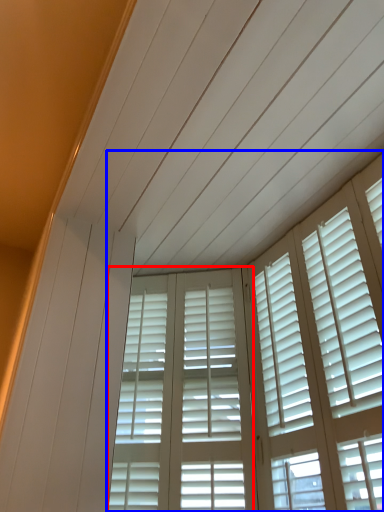
Question: Which object appears closest to the camera in this image, screen door (highlighted by a red box) or window (highlighted by a blue box)?

Choices:
 (A) screen door
 (B) window

Answer: (B)